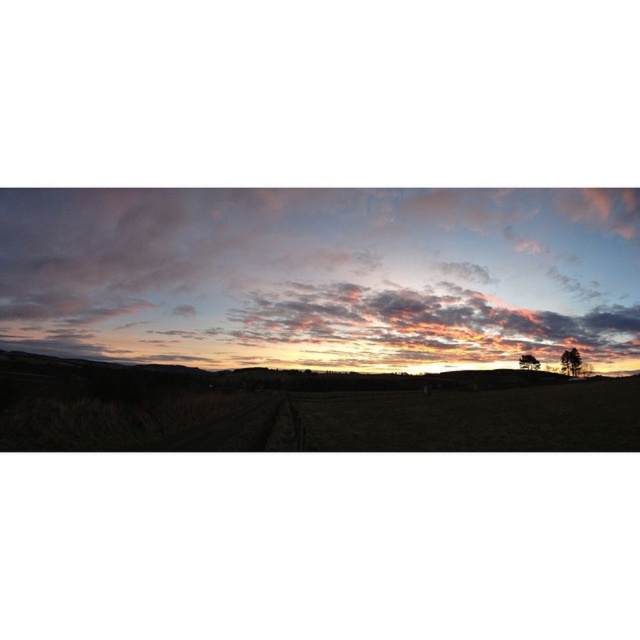
Can you confirm if pastel cotton clouds at upper center is wider than green matte tree at right?

Correct, the width of pastel cotton clouds at upper center exceeds that of green matte tree at right.

Is pastel cotton clouds at upper center positioned before green matte tree at right?

Yes, pastel cotton clouds at upper center is closer to the viewer.

Is point (632, 227) closer to viewer compared to point (563, 362)?

Yes, it is in front of point (563, 362).

At what (x,y) coordinates should I click in order to perform the action: click on pastel cotton clouds at upper center. Please return your answer as a coordinate pair (x, y). The width and height of the screenshot is (640, 640). Looking at the image, I should click on (321, 275).

The width and height of the screenshot is (640, 640). What do you see at coordinates (321, 275) in the screenshot?
I see `pastel cotton clouds at upper center` at bounding box center [321, 275].

At what (x,y) coordinates should I click in order to perform the action: click on pastel cotton clouds at upper center. Please return your answer as a coordinate pair (x, y). This screenshot has height=640, width=640. Looking at the image, I should click on (321, 275).

The height and width of the screenshot is (640, 640). Find the location of `pastel cotton clouds at upper center`. pastel cotton clouds at upper center is located at coordinates (321, 275).

You are a GUI agent. You are given a task and a screenshot of the screen. Output one action in this format:
    pyautogui.click(x=<x>, y=<y>)
    Task: Click on the pastel cotton clouds at upper center
    
    Given the screenshot: What is the action you would take?
    pyautogui.click(x=321, y=275)

Does point (577, 348) lie behind point (525, 362)?

Yes, it is.

Is green matte tree at right positioned before green leafy tree at lower right?

No, it is not.

Is point (572, 356) farther from viewer compared to point (522, 362)?

That is True.

Where is `green matte tree at right`? green matte tree at right is located at coordinates (570, 362).